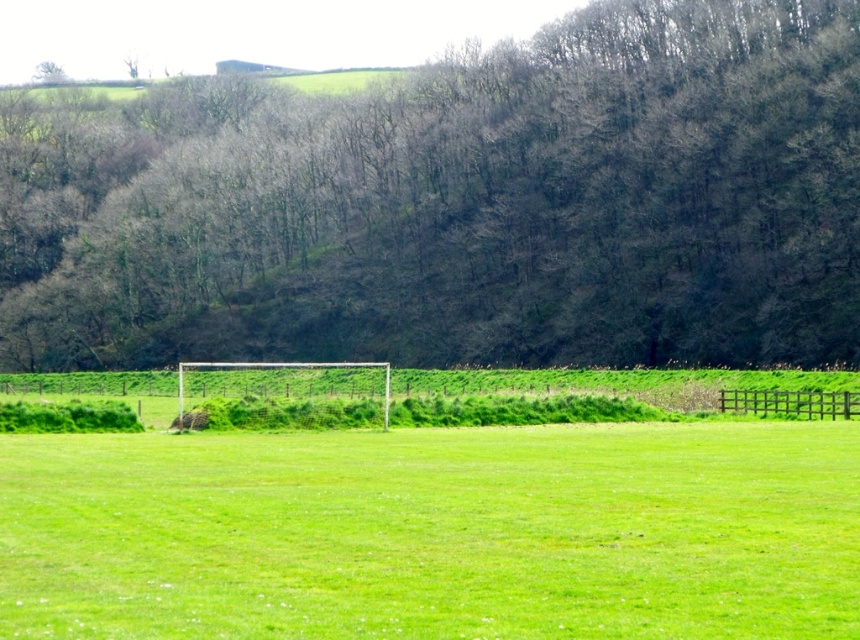
Question: In this image, where is furry brown dog at center located relative to green leafy tree at upper left?

Choices:
 (A) right
 (B) left

Answer: (A)

Question: Which of the following is the closest to the observer?

Choices:
 (A) (201, 419)
 (B) (43, 83)
 (C) (562, 272)

Answer: (A)

Question: Which point appears closest to the camera in this image?

Choices:
 (A) (234, 353)
 (B) (40, 72)
 (C) (194, 419)

Answer: (C)

Question: Can you confirm if brown leafless trees at center is positioned below furry brown dog at center?

Choices:
 (A) yes
 (B) no

Answer: (B)

Question: Where is furry brown dog at center located in relation to green leafy tree at upper left in the image?

Choices:
 (A) below
 (B) above

Answer: (A)

Question: Which object is positioned closest to the furry brown dog at center?

Choices:
 (A) green leafy tree at upper left
 (B) brown leafless trees at center

Answer: (B)